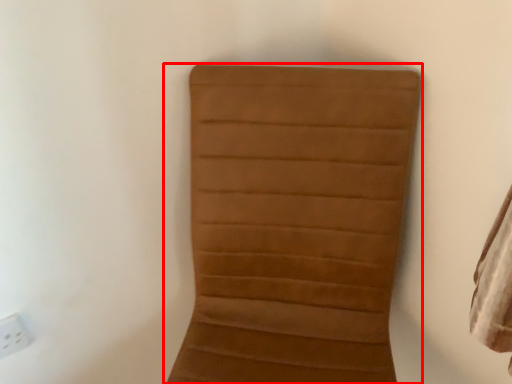
Question: From the image's perspective, considering the relative positions of furniture (annotated by the red box) and electric outlet in the image provided, where is furniture (annotated by the red box) located with respect to the staircase?

Choices:
 (A) above
 (B) below

Answer: (B)